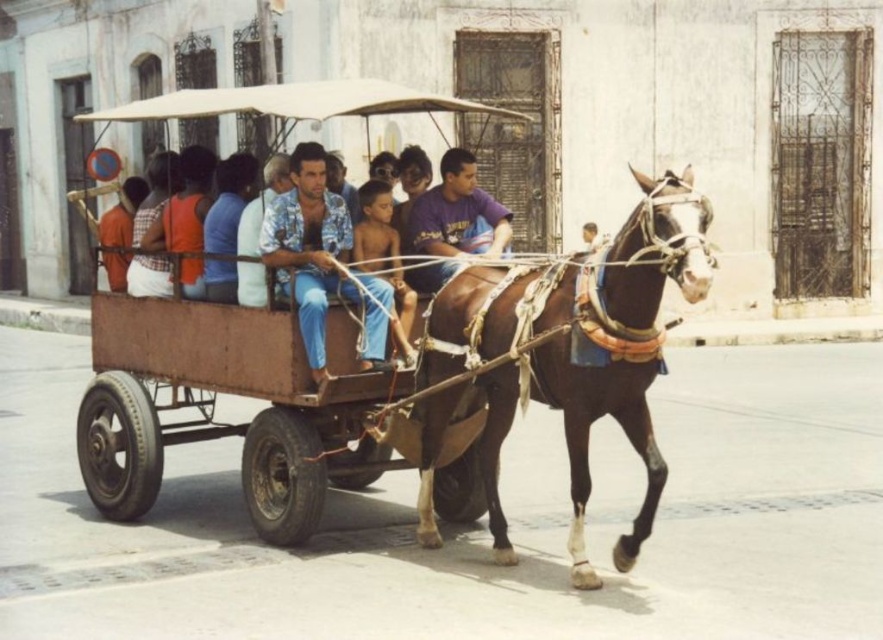
The width and height of the screenshot is (883, 640). What do you see at coordinates (232, 394) in the screenshot?
I see `rusty metal wagon at center` at bounding box center [232, 394].

Which is more to the right, rusty metal wagon at center or brown glossy horse at center?

Positioned to the right is brown glossy horse at center.

Which is in front, point (281, 388) or point (536, 385)?

Point (536, 385) is in front.

Where is `rusty metal wagon at center`? Image resolution: width=883 pixels, height=640 pixels. rusty metal wagon at center is located at coordinates (232, 394).

Identify the location of rusty metal wagon at center. This screenshot has width=883, height=640. (232, 394).

Does point (259, 330) come behind point (315, 355)?

That is True.

Identify the location of rusty metal wagon at center. (232, 394).

Does point (336, 208) lie behind point (420, 198)?

No, it is in front of (420, 198).

Between point (333, 273) and point (459, 204), which one is positioned behind?

Positioned behind is point (459, 204).

Find the location of a particular element. This screenshot has width=883, height=640. floral shirt at center is located at coordinates tap(321, 260).

Identify the location of floral shirt at center. The image size is (883, 640). (321, 260).